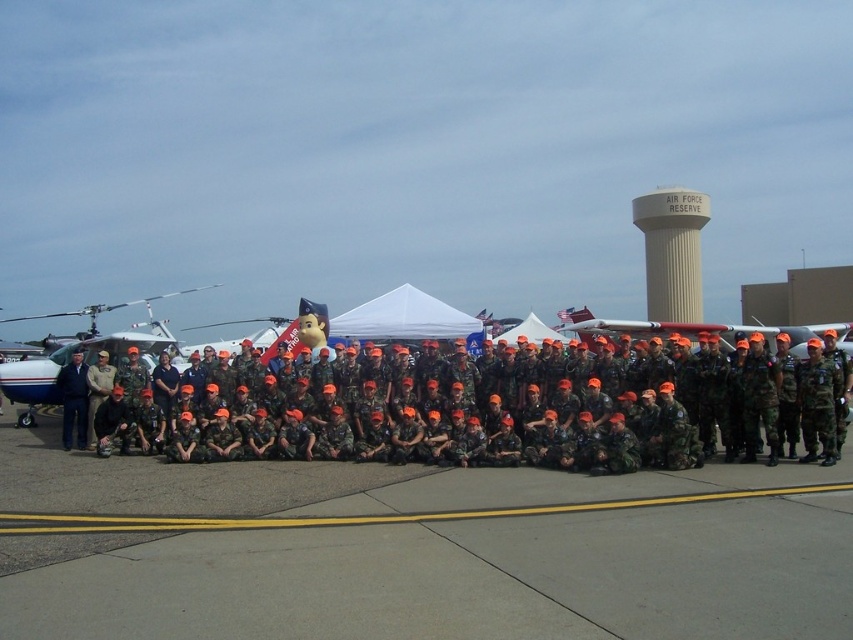
Question: Is gray asphalt tarmac at center below beige concrete water tower at upper center?

Choices:
 (A) no
 (B) yes

Answer: (B)

Question: Which point is farther to the camera?

Choices:
 (A) gray asphalt tarmac at center
 (B) beige concrete water tower at upper center
 (C) camouflage uniform at center

Answer: (B)

Question: Is gray asphalt tarmac at center bigger than white matte airplane at left?

Choices:
 (A) no
 (B) yes

Answer: (A)

Question: Which of the following is the farthest from the observer?

Choices:
 (A) (694, 282)
 (B) (563, 426)
 (C) (810, 637)

Answer: (A)

Question: Which object is the farthest from the camouflage uniform at center?

Choices:
 (A) beige concrete water tower at upper center
 (B) white matte airplane at left
 (C) gray asphalt tarmac at center

Answer: (A)

Question: Where is camouflage uniform at center located in relation to white matte airplane at left in the image?

Choices:
 (A) right
 (B) left

Answer: (A)